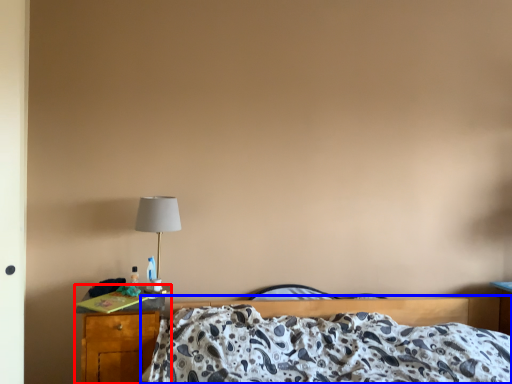
Question: Which object is closer to the camera taking this photo, nightstand (highlighted by a red box) or bed (highlighted by a blue box)?

Choices:
 (A) nightstand
 (B) bed

Answer: (B)